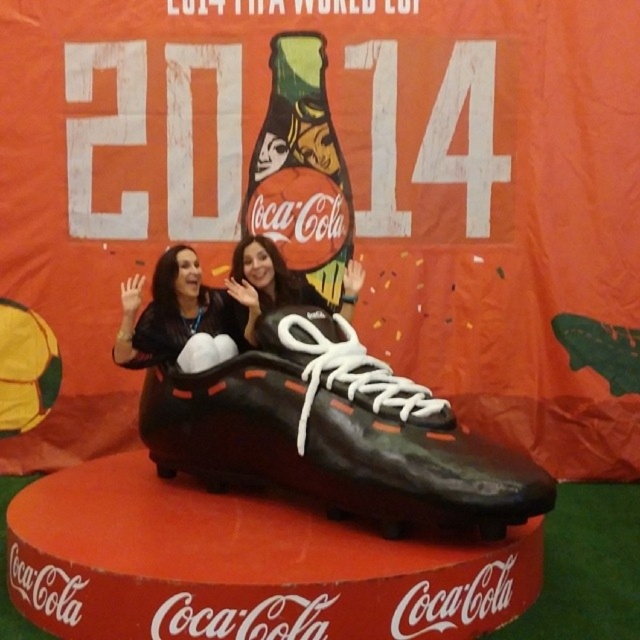
Question: Among these points, which one is nearest to the camera?

Choices:
 (A) (312, 97)
 (B) (355, 353)
 (C) (195, 342)

Answer: (B)

Question: Does black rubber shoe at center have a lesser width compared to green matte coca-cola bottle at center?

Choices:
 (A) no
 (B) yes

Answer: (A)

Question: From the image, what is the correct spatial relationship of green matte coca-cola bottle at center in relation to matte black top at center?

Choices:
 (A) right
 (B) left

Answer: (A)

Question: Which object appears closest to the camera in this image?

Choices:
 (A) black matte shoe at center
 (B) matte black top at center
 (C) matte black shoe at center
 (D) green matte coca-cola bottle at center

Answer: (A)

Question: From the image, what is the correct spatial relationship of black matte shoe at center in relation to matte black top at center?

Choices:
 (A) below
 (B) above

Answer: (A)

Question: Among these objects, which one is farthest from the camera?

Choices:
 (A) matte black shoe at center
 (B) green matte coca-cola bottle at center
 (C) matte black top at center
 (D) black rubber shoe at center

Answer: (B)